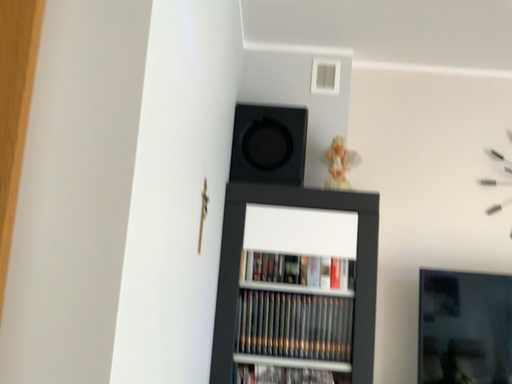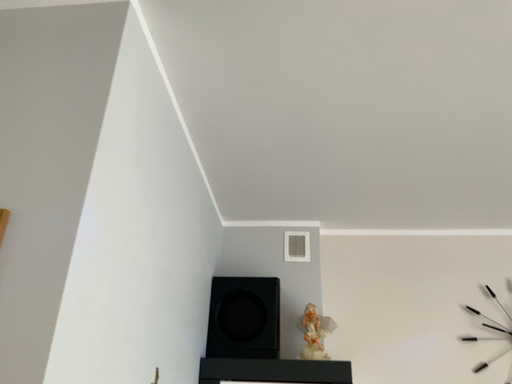
Question: How did the camera likely rotate when shooting the video?

Choices:
 (A) rotated upward
 (B) rotated downward

Answer: (A)